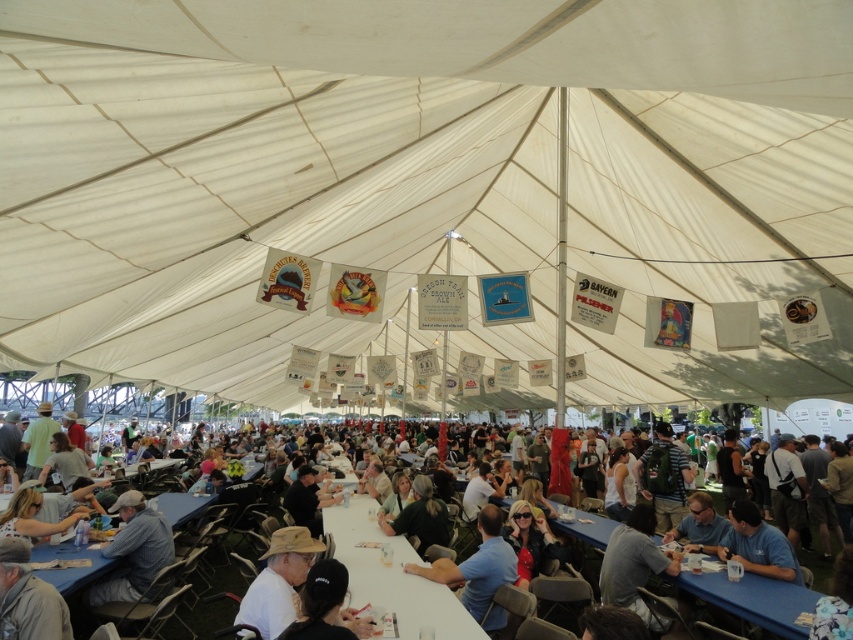
Can you confirm if white fabric table at center is positioned below gray fabric shirt at lower right?

Answer: Yes, white fabric table at center is below gray fabric shirt at lower right.

Does white fabric table at center have a greater width compared to gray fabric shirt at lower right?

Yes, white fabric table at center is wider than gray fabric shirt at lower right.

Who is more distant from viewer, (535,460) or (646,548)?

The point (535,460) is more distant.

The width and height of the screenshot is (853, 640). In order to click on white fabric table at center in this screenshot , I will do `click(186, 509)`.

Is gray fabric shirt at lower right thinner than black matte shirt at center?

Yes, gray fabric shirt at lower right is thinner than black matte shirt at center.

What do you see at coordinates (635, 564) in the screenshot? The width and height of the screenshot is (853, 640). I see `gray fabric shirt at lower right` at bounding box center [635, 564].

Locate an element on the screen. gray fabric shirt at lower right is located at coordinates (635, 564).

Can you confirm if white fabric table at center is smaller than black shirt at center?

No.

Who is positioned more to the right, white fabric table at center or black shirt at center?

Positioned to the right is white fabric table at center.

The image size is (853, 640). I want to click on white fabric table at center, so click(186, 509).